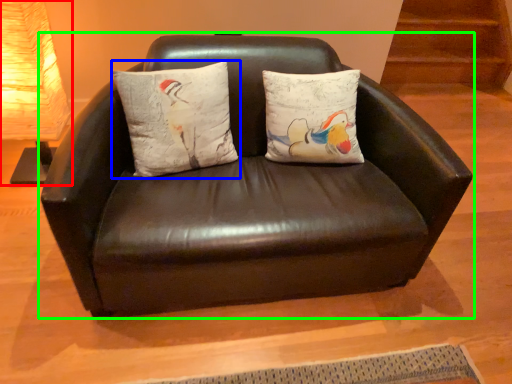
Question: Considering the real-world distances, which object is closest to table lamp (highlighted by a red box)? pillow (highlighted by a blue box) or studio couch (highlighted by a green box).

Choices:
 (A) pillow
 (B) studio couch

Answer: (A)